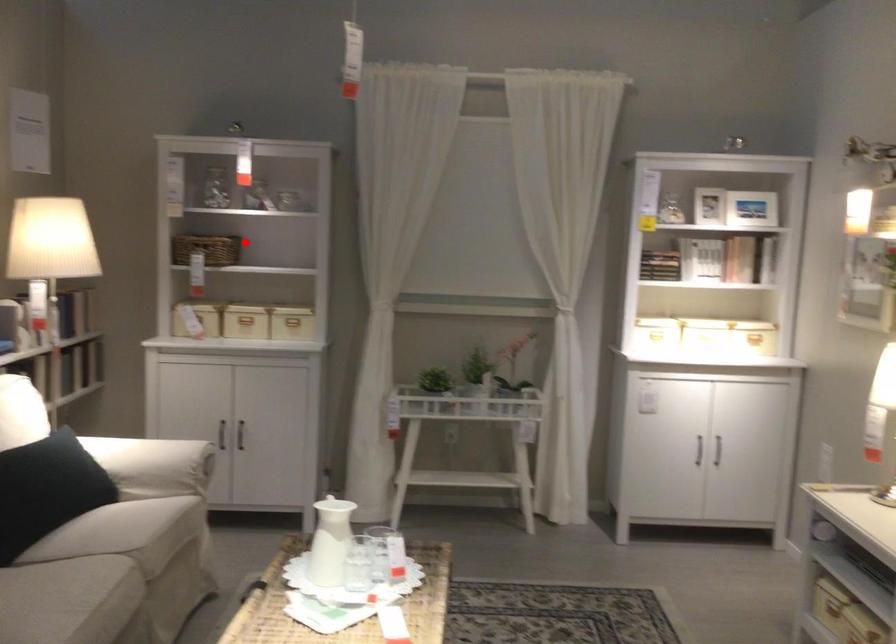
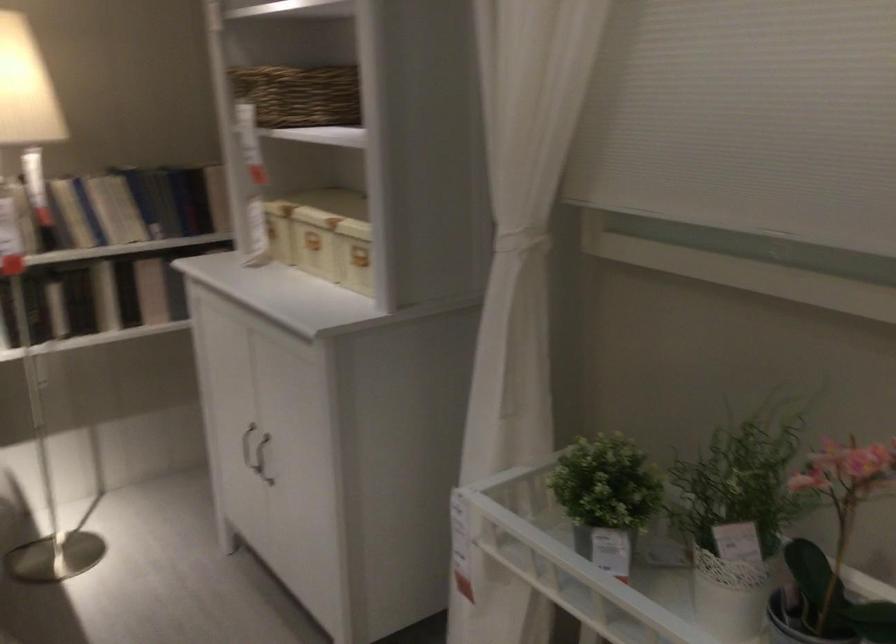
Where in the second image is the point corresponding to the highlighted location from the first image?

(298, 93)